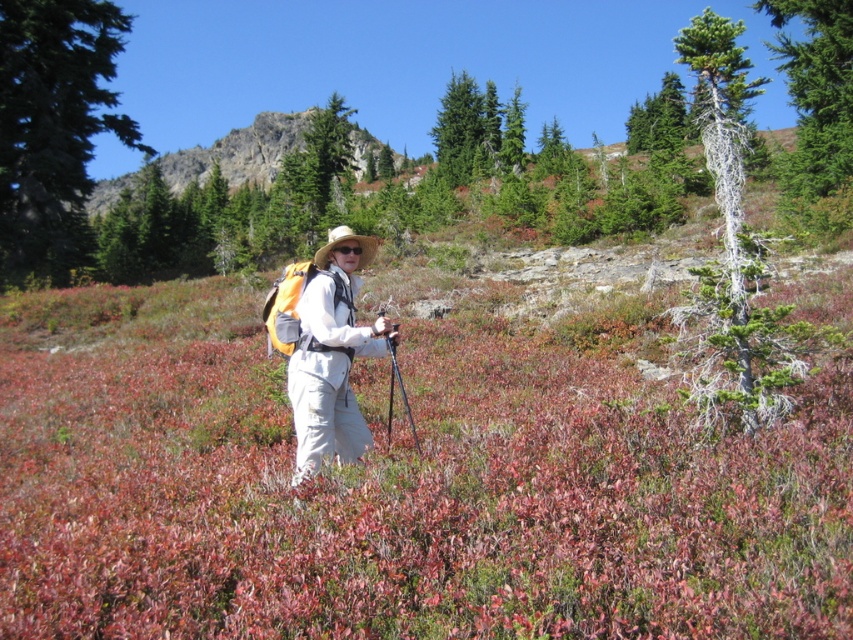
Question: Considering the real-world distances, which object is farthest from the gray-green bark tree at right?

Choices:
 (A) green textured tree at upper right
 (B) green leafy tree at left
 (C) rugged rock at upper center

Answer: (C)

Question: Among these points, which one is nearest to the camera?

Choices:
 (A) (57, 112)
 (B) (322, 387)

Answer: (B)

Question: Which object is farther from the camera taking this photo?

Choices:
 (A) green leafy tree at left
 (B) gray-green bark tree at right
 (C) rugged rock at upper center
 (D) green textured tree at upper right

Answer: (C)

Question: Does gray-green bark tree at right appear under matte white pants at center?

Choices:
 (A) yes
 (B) no

Answer: (B)

Question: Is matte white pants at center to the right of rugged rock at upper center from the viewer's perspective?

Choices:
 (A) no
 (B) yes

Answer: (B)

Question: In this image, where is matte white pants at center located relative to rugged rock at upper center?

Choices:
 (A) below
 (B) above

Answer: (A)